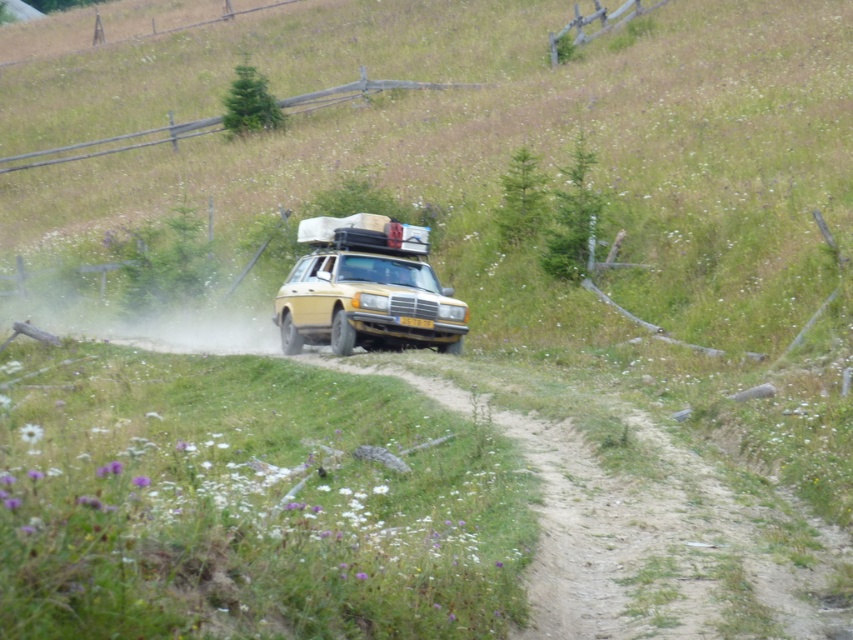
Identify the location of yellow matte/solid car at center. (364, 289).

Can you confirm if yellow matte/solid car at center is wider than yellow plastic license plate at center?

Yes.

Measure the distance between point (337, 344) and camera.

A distance of 18.78 meters exists between point (337, 344) and camera.

Identify the location of yellow matte/solid car at center. (364, 289).